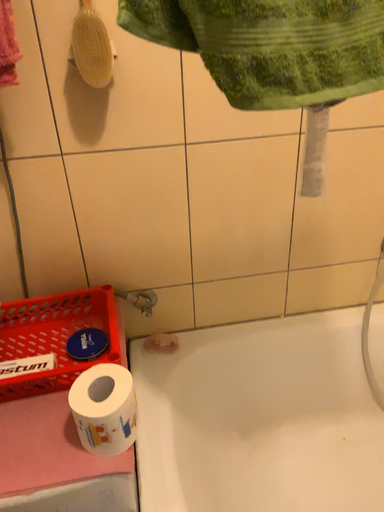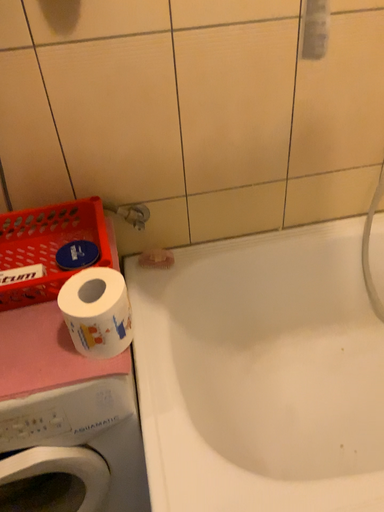
Question: Which way did the camera rotate in the video?

Choices:
 (A) rotated upward
 (B) rotated downward

Answer: (B)